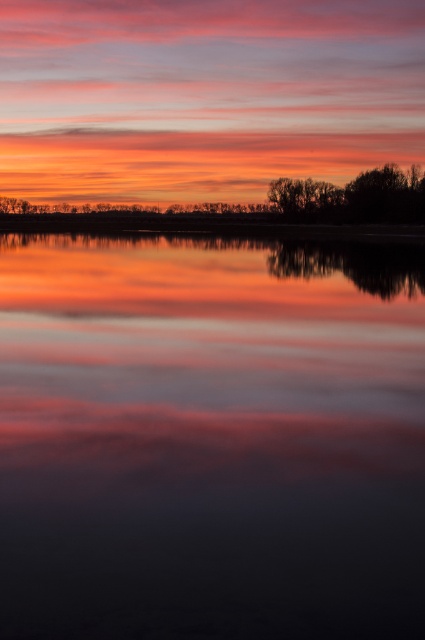
You are standing on the shore of the lake and want to take a photo of the sunset reflection. Since the smooth water at center is below the silhouette tree at right, will the tree block the reflection of the sunset in the water?

The smooth water at center is located below the silhouette tree at right, so the tree might block part of the reflection depending on its position. To capture the full reflection, move to a spot where the silhouette tree at right is not casting an overhanging shadow on the smooth water at center.

You are an artist trying to paint the sunset scene. You want to ensure the smooth water at center and the silhouette tree at right are proportionally accurate. Which object should you paint smaller in your artwork?

The smooth water at center should be painted smaller than the silhouette tree at right because the smooth water at center has a smaller size compared to silhouette tree at right according to the description.